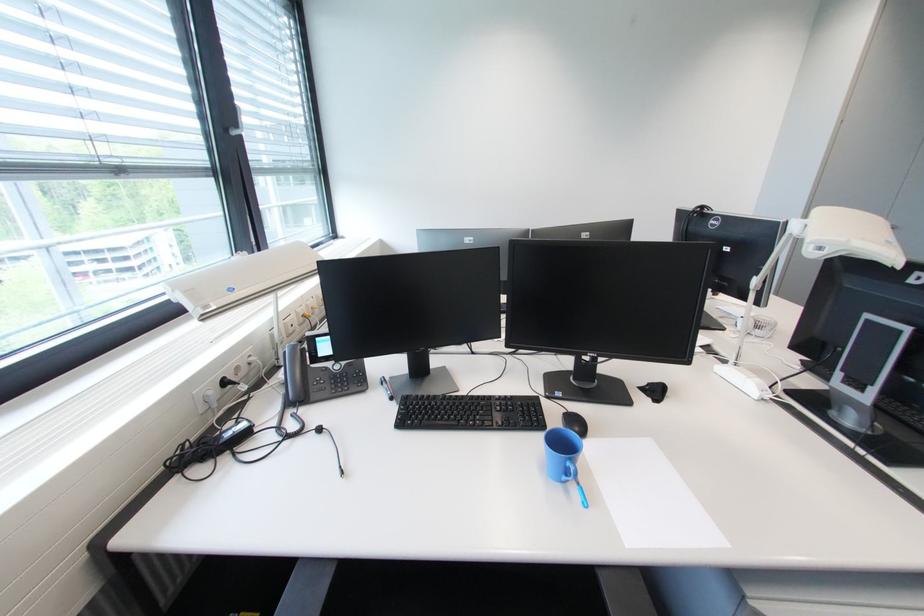
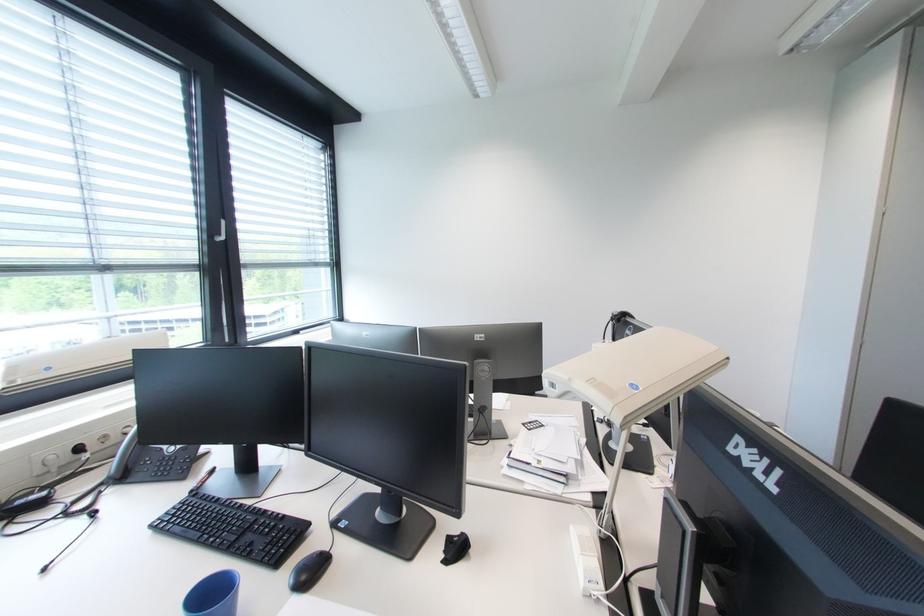
Where in the second image is the point corresponding to (x=856, y=243) from the first image?

(577, 381)